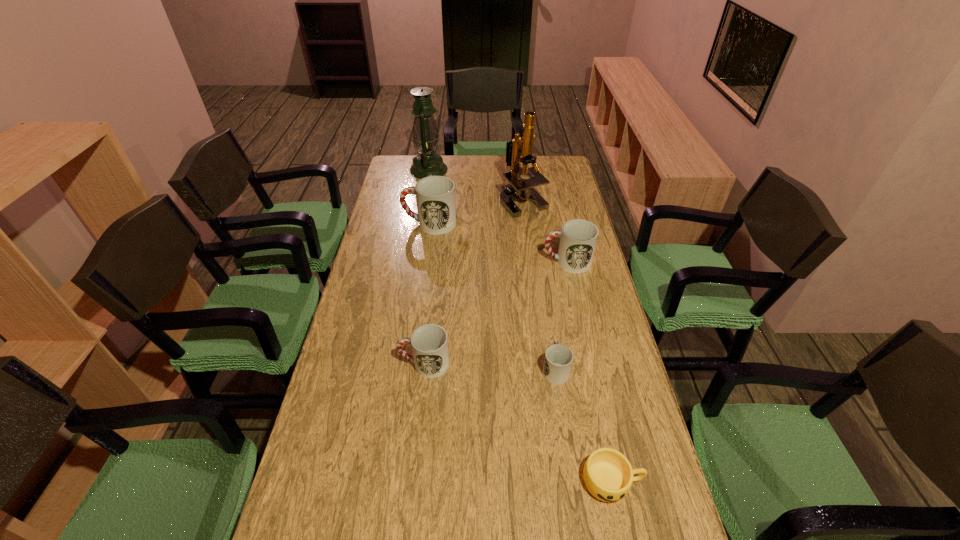
At what (x,y) coordinates should I click in order to perform the action: click on the farthest object. Please return your answer as a coordinate pair (x, y). Image resolution: width=960 pixels, height=540 pixels. Looking at the image, I should click on (425, 135).

Identify the location of gold microscope. This screenshot has height=540, width=960. (523, 188).

What are the coordinates of `the farthest red cup` in the screenshot? It's located at (435, 195).

Image resolution: width=960 pixels, height=540 pixels. Identify the location of the third tallest object. (435, 195).

You are a GUI agent. You are given a task and a screenshot of the screen. Output one action in this format:
    pyautogui.click(x=<x>, y=<y>)
    Task: Click on the second tallest cup
    The width and height of the screenshot is (960, 540).
    Given the screenshot: What is the action you would take?
    pyautogui.click(x=578, y=238)

Locate an element on the screen. The image size is (960, 540). the third smallest red cup is located at coordinates (578, 238).

Where is `the third tallest cup`? Image resolution: width=960 pixels, height=540 pixels. the third tallest cup is located at coordinates (429, 342).

This screenshot has height=540, width=960. I want to click on the fifth tallest object, so pos(429,342).

The height and width of the screenshot is (540, 960). Find the location of `the fourth tallest cup`. the fourth tallest cup is located at coordinates (558, 359).

You are a GUI agent. You are given a task and a screenshot of the screen. Output one action in this format:
    pyautogui.click(x=<x>, y=<y>)
    Task: Click on the sixth tallest object
    The image size is (960, 540).
    Given the screenshot: What is the action you would take?
    pyautogui.click(x=558, y=359)